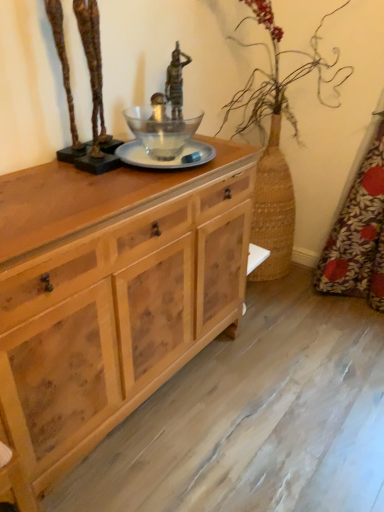
Question: Would you say bronze statue at center contains bronze sculpture at upper left?

Choices:
 (A) no
 (B) yes

Answer: (A)

Question: Does bronze statue at center turn towards bronze sculpture at upper left?

Choices:
 (A) no
 (B) yes

Answer: (A)

Question: Is bronze statue at center looking in the opposite direction of bronze sculpture at upper left?

Choices:
 (A) yes
 (B) no

Answer: (B)

Question: Can you confirm if bronze statue at center is shorter than bronze sculpture at upper left?

Choices:
 (A) yes
 (B) no

Answer: (A)

Question: From a real-world perspective, is bronze statue at center on bronze sculpture at upper left?

Choices:
 (A) yes
 (B) no

Answer: (B)

Question: From the image's perspective, is bronze statue at center over bronze sculpture at upper left?

Choices:
 (A) no
 (B) yes

Answer: (B)

Question: Can bronze statue at center be found inside bronze sculpture at upper left?

Choices:
 (A) yes
 (B) no

Answer: (B)

Question: Is bronze sculpture at upper left wider than bronze statue at center?

Choices:
 (A) no
 (B) yes

Answer: (B)

Question: Is bronze sculpture at upper left outside bronze statue at center?

Choices:
 (A) yes
 (B) no

Answer: (A)

Question: Is bronze sculpture at upper left positioned before bronze statue at center?

Choices:
 (A) yes
 (B) no

Answer: (A)

Question: Is bronze sculpture at upper left in contact with bronze statue at center?

Choices:
 (A) yes
 (B) no

Answer: (B)

Question: Could you tell me if bronze sculpture at upper left is facing bronze statue at center?

Choices:
 (A) yes
 (B) no

Answer: (B)

Question: Is floral fabric at right further to camera compared to natural wood cabinet at center?

Choices:
 (A) yes
 (B) no

Answer: (A)